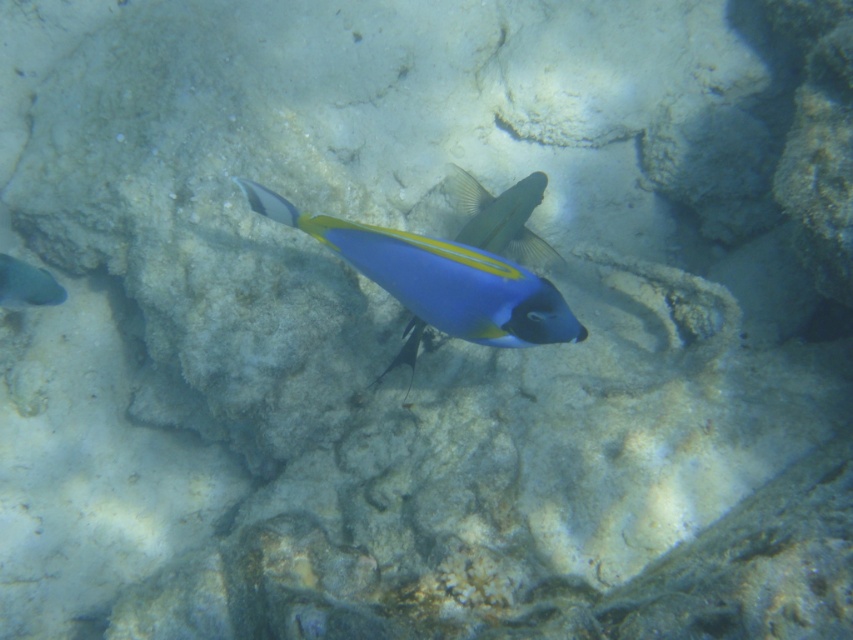
You are a marine biologist observing underwater life. You notice a shiny blue fish at center and a matte gray fish at left. If you want to place a 30 inch long measuring tape between them to measure their distance, will the tape be long enough to reach both ends without bending?

The distance between the shiny blue fish at center and the matte gray fish at left is 27.51 inches. Since the measuring tape is 30 inches long, it is long enough to reach both ends without bending.

You are a marine biologist observing an underwater scene. You notice two fish labeled as shiny blue fish at center and blue glossy fish at center. Which fish do you think has a greater width?

The shiny blue fish at center might be wider than blue glossy fish at center according to the description.

You are a marine biologist observing an underwater scene. You notice a point marked at coordinates (437,282). What object is located at that point?

The point at coordinates (437,282) indicates the shiny blue fish at center.